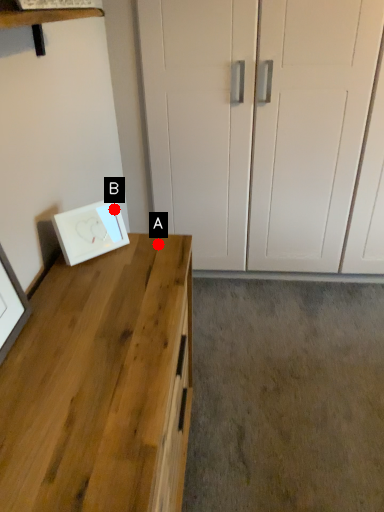
Question: Two points are circled on the image, labeled by A and B beside each circle. Which of the following is the closest to the observer?

Choices:
 (A) A is closer
 (B) B is closer

Answer: (A)